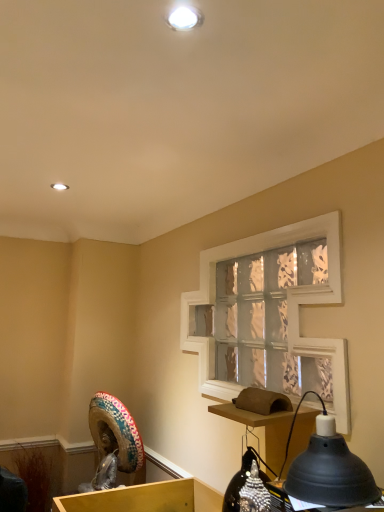
Locate an element on the screen. black matte lamp at lower right is located at coordinates (328, 468).

In order to face brown cardboard table at lower right, should I rotate leftwards or rightwards?

You should look right and rotate roughly 9.374 degrees.

Describe the element at coordinates (265, 429) in the screenshot. I see `brown cardboard table at lower right` at that location.

You are a GUI agent. You are given a task and a screenshot of the screen. Output one action in this format:
    pyautogui.click(x=<x>, y=<y>)
    Task: Click on the black matte lamp at lower right
    This screenshot has width=384, height=512.
    Given the screenshot: What is the action you would take?
    pyautogui.click(x=328, y=468)

From the image's perspective, which is below, clear glass window screen at center or black matte lamp at lower right?

black matte lamp at lower right appears lower in the image.

Does clear glass window screen at center lie in front of black matte lamp at lower right?

No, clear glass window screen at center is further to the viewer.

Choose the correct answer: Is clear glass window screen at center inside black matte lamp at lower right or outside it?

clear glass window screen at center is not enclosed by black matte lamp at lower right.

In the image, there is a black matte lamp at lower right. Find the location of `window screen above it (from the image's perspective)`. window screen above it (from the image's perspective) is located at coordinates click(x=288, y=290).

Can you tell me how much black matte lamp at lower right and brown cardboard table at lower right differ in facing direction?

The angular difference between black matte lamp at lower right and brown cardboard table at lower right is 2.54 degrees.

From a real-world perspective, which object rests below the other?

From a 3D spatial view, brown cardboard table at lower right is below.

Considering the sizes of objects black matte lamp at lower right and brown cardboard table at lower right in the image provided, who is wider, black matte lamp at lower right or brown cardboard table at lower right?

Wider between the two is brown cardboard table at lower right.

Between black matte lamp at lower right and brown cardboard table at lower right, which one appears on the left side from the viewer's perspective?

Positioned to the left is brown cardboard table at lower right.

From the image's perspective, is matte white recessed light at upper center above clear glass window screen at center?

Yes, from the image's perspective, matte white recessed light at upper center is above clear glass window screen at center.

Is matte white recessed light at upper center facing towards clear glass window screen at center?

No.

Which is less distant, (55,185) or (333,246)?

Positioned in front is point (333,246).

From a real-world perspective, is matte white recessed light at upper center on clear glass window screen at center?

Correct, in the physical world, matte white recessed light at upper center is higher than clear glass window screen at center.

Where is `sculpture on the right side of matte white recessed light at upper center`? The height and width of the screenshot is (512, 384). sculpture on the right side of matte white recessed light at upper center is located at coordinates (113, 442).

Considering the sizes of objects multicolored fabric sombrero at lower left and matte white recessed light at upper center in the image provided, who is thinner, multicolored fabric sombrero at lower left or matte white recessed light at upper center?

matte white recessed light at upper center is thinner.

Measure the distance between multicolored fabric sombrero at lower left and matte white recessed light at upper center.

They are 1.34 meters apart.

Is multicolored fabric sombrero at lower left turned away from matte white recessed light at upper center?

No.

Consider the image. Is black matte lamp at lower right shorter than multicolored fabric sombrero at lower left?

Indeed, black matte lamp at lower right has a lesser height compared to multicolored fabric sombrero at lower left.

Can you confirm if black matte lamp at lower right is smaller than multicolored fabric sombrero at lower left?

Yes, black matte lamp at lower right is smaller than multicolored fabric sombrero at lower left.

Based on the photo, can you see black matte lamp at lower right touching multicolored fabric sombrero at lower left?

black matte lamp at lower right is not next to multicolored fabric sombrero at lower left, and they're not touching.

Is there a large distance between clear glass window screen at center and matte white recessed light at upper center?

clear glass window screen at center is far away from matte white recessed light at upper center.

Looking at this image, considering the relative positions of clear glass window screen at center and matte white recessed light at upper center in the image provided, is clear glass window screen at center to the right of matte white recessed light at upper center from the viewer's perspective?

Correct, you'll find clear glass window screen at center to the right of matte white recessed light at upper center.

Looking at this image, from a real-world perspective, is clear glass window screen at center positioned above or below matte white recessed light at upper center?

In terms of real-world spatial position, clear glass window screen at center is below matte white recessed light at upper center.

Considering the sizes of objects brown cardboard table at lower right and multicolored fabric sombrero at lower left in the image provided, who is shorter, brown cardboard table at lower right or multicolored fabric sombrero at lower left?

Standing shorter between the two is brown cardboard table at lower right.

Considering the sizes of objects brown cardboard table at lower right and multicolored fabric sombrero at lower left in the image provided, who is bigger, brown cardboard table at lower right or multicolored fabric sombrero at lower left?

multicolored fabric sombrero at lower left.

Which point is more forward, (226, 411) or (95, 434)?

The point (226, 411) is closer.

Is multicolored fabric sombrero at lower left at the back of brown cardboard table at lower right?

No, brown cardboard table at lower right is not facing the opposite direction of multicolored fabric sombrero at lower left.

The height and width of the screenshot is (512, 384). What are the coordinates of `window screen behind the black matte lamp at lower right` in the screenshot? It's located at (288, 290).

There is a brown cardboard table at lower right. What are the coordinates of `lamp above it (from a real-world perspective)` in the screenshot? It's located at (328, 468).

Estimate the real-world distances between objects in this image. Which object is closer to black matte lamp at lower right, multicolored fabric sombrero at lower left or clear glass window screen at center?

clear glass window screen at center is positioned closer to the anchor black matte lamp at lower right.

Estimate the real-world distances between objects in this image. Which object is closer to brown cardboard table at lower right, matte white recessed light at upper center or black matte lamp at lower right?

The object closer to brown cardboard table at lower right is black matte lamp at lower right.

From the image, which object appears to be farther from black matte lamp at lower right, multicolored fabric sombrero at lower left or matte white recessed light at upper center?

The object further to black matte lamp at lower right is matte white recessed light at upper center.

From the image, which object appears to be nearer to multicolored fabric sombrero at lower left, matte white recessed light at upper center or brown cardboard table at lower right?

The object closer to multicolored fabric sombrero at lower left is brown cardboard table at lower right.

Considering their positions, is matte white recessed light at upper center positioned closer to multicolored fabric sombrero at lower left than clear glass window screen at center?

clear glass window screen at center lies closer to multicolored fabric sombrero at lower left than the other object.

When comparing their distances from matte white recessed light at upper center, does multicolored fabric sombrero at lower left or clear glass window screen at center seem further?

Among the two, multicolored fabric sombrero at lower left is located further to matte white recessed light at upper center.

Considering their positions, is black matte lamp at lower right positioned further to clear glass window screen at center than multicolored fabric sombrero at lower left?

multicolored fabric sombrero at lower left is positioned further to the anchor clear glass window screen at center.

Based on their spatial positions, is matte white recessed light at upper center or clear glass window screen at center closer to brown cardboard table at lower right?

clear glass window screen at center lies closer to brown cardboard table at lower right than the other object.

You are a GUI agent. You are given a task and a screenshot of the screen. Output one action in this format:
    pyautogui.click(x=<x>, y=<y>)
    Task: Click on the table between black matte lamp at lower right and clear glass window screen at center in the front-back direction
    Image resolution: width=384 pixels, height=512 pixels.
    Given the screenshot: What is the action you would take?
    pyautogui.click(x=265, y=429)

At what (x,y) coordinates should I click in order to perform the action: click on lamp between matte white recessed light at upper center and multicolored fabric sombrero at lower left from top to bottom. Please return your answer as a coordinate pair (x, y). The height and width of the screenshot is (512, 384). Looking at the image, I should click on (328, 468).

Where is `window screen between brown cardboard table at lower right and multicolored fabric sombrero at lower left along the z-axis`? The image size is (384, 512). window screen between brown cardboard table at lower right and multicolored fabric sombrero at lower left along the z-axis is located at coordinates (288, 290).

Locate an element on the screen. table between matte white recessed light at upper center and clear glass window screen at center is located at coordinates (265, 429).